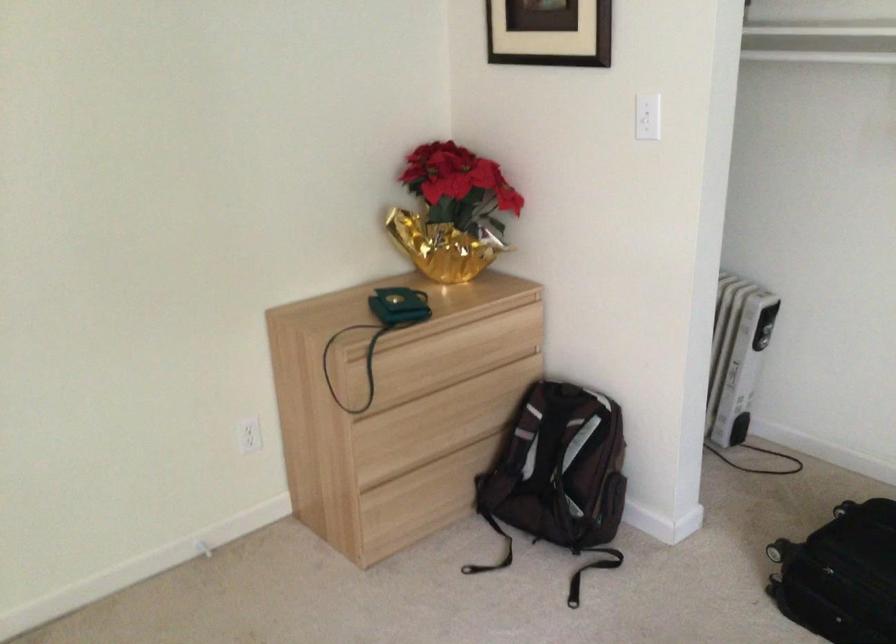
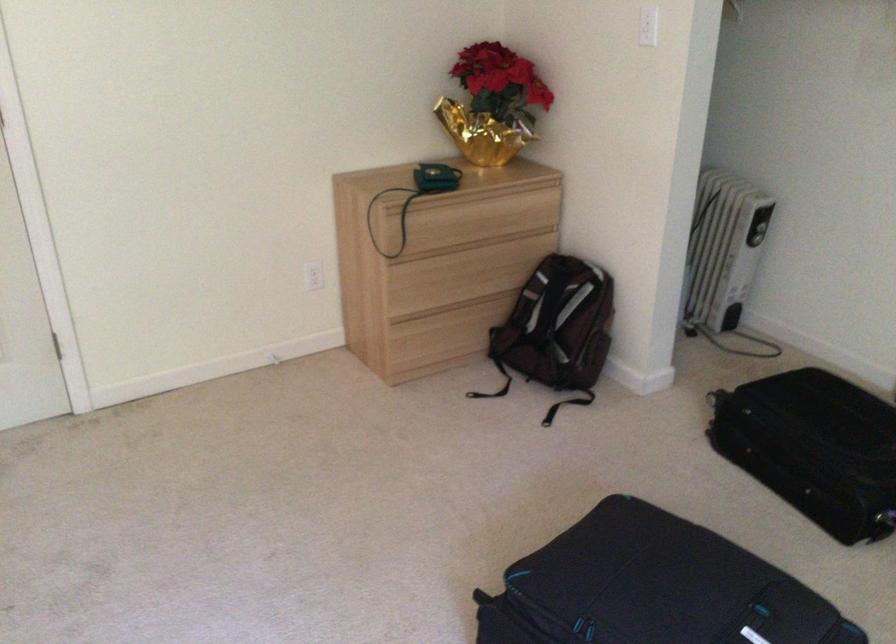
The point at (409, 426) is marked in the first image. Where is the corresponding point in the second image?

(435, 277)